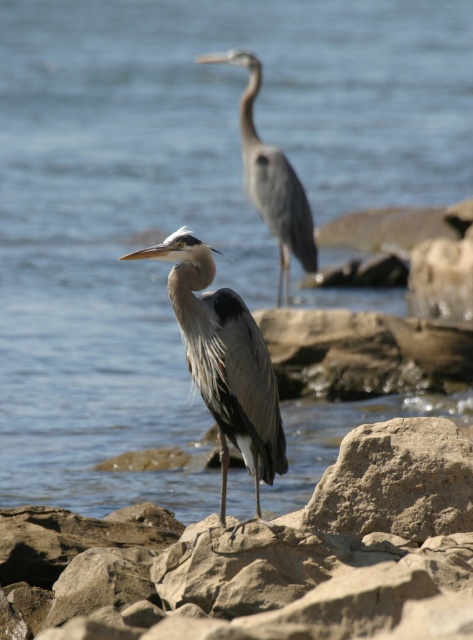
Question: Can you confirm if rough textured rock at center is bigger than gray matte heron at center?

Choices:
 (A) no
 (B) yes

Answer: (A)

Question: Which point is closer to the camera?

Choices:
 (A) gray matte heron at center
 (B) gray matte heron at upper center
 (C) rough textured rock at center

Answer: (A)

Question: Does smooth gray rock at center appear on the right side of rough textured rock at center?

Choices:
 (A) no
 (B) yes

Answer: (A)

Question: Is rough textured rock at center to the left of gray matte heron at upper center from the viewer's perspective?

Choices:
 (A) yes
 (B) no

Answer: (B)

Question: Which object appears farthest from the camera in this image?

Choices:
 (A) rough textured rock at center
 (B) gray matte heron at upper center
 (C) smooth gray rock at center
 (D) gray matte heron at center

Answer: (B)

Question: Which object appears closest to the camera in this image?

Choices:
 (A) gray matte heron at center
 (B) gray matte heron at upper center

Answer: (A)